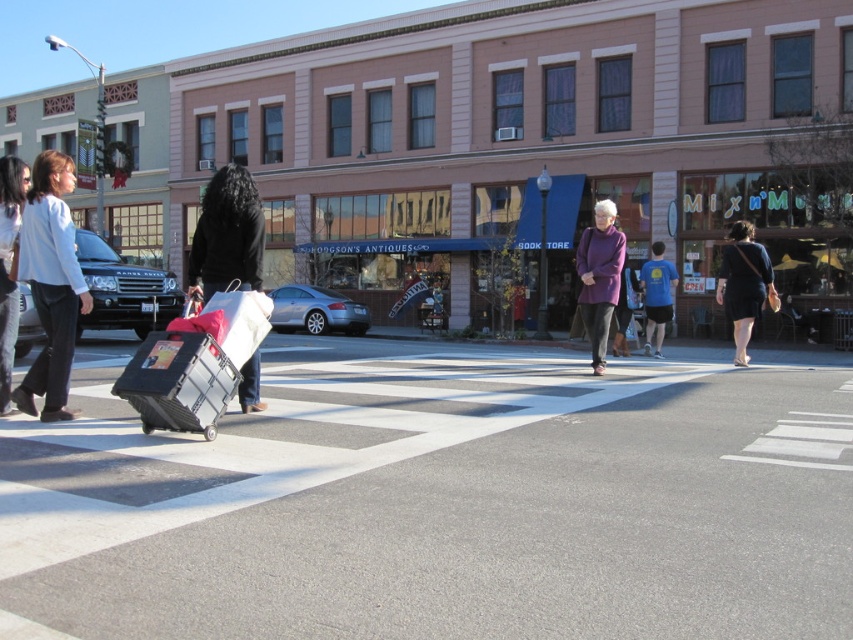
You are standing at the crosswalk and want to pick up the black fabric bag at center. Which direction should you walk to reach it?

The black fabric bag at center is located at point (227, 234), so you should walk towards the center of the image to reach it.

You are a delivery person trying to navigate through the street. You see the light blue cotton shirt at left and the metallic silver cart at lower left. Which object is higher in position from the ground?

The light blue cotton shirt at left is taller than the metallic silver cart at lower left.